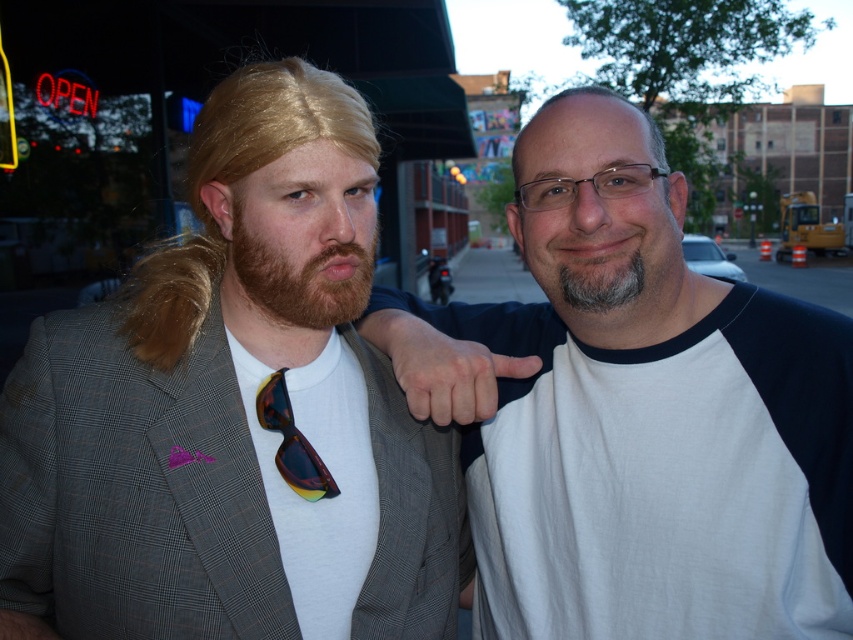
Question: Which of the following is the farthest from the observer?

Choices:
 (A) dark brown beard at center
 (B) white cotton t-shirt at right

Answer: (B)

Question: Which of these objects is positioned closest to the matte gray blazer at left?

Choices:
 (A) dark brown beard at center
 (B) gray/soft hair at center

Answer: (A)

Question: Which object appears closest to the camera in this image?

Choices:
 (A) gray/soft hair at center
 (B) matte gray blazer at left
 (C) multicolored plastic sunglasses at center

Answer: (B)

Question: Is matte gray blazer at left to the right of multicolored plastic sunglasses at center from the viewer's perspective?

Choices:
 (A) yes
 (B) no

Answer: (B)

Question: Is white cotton t-shirt at right bigger than dark brown beard at center?

Choices:
 (A) no
 (B) yes

Answer: (B)

Question: Does matte gray blazer at left have a lesser width compared to white cotton t-shirt at right?

Choices:
 (A) yes
 (B) no

Answer: (A)